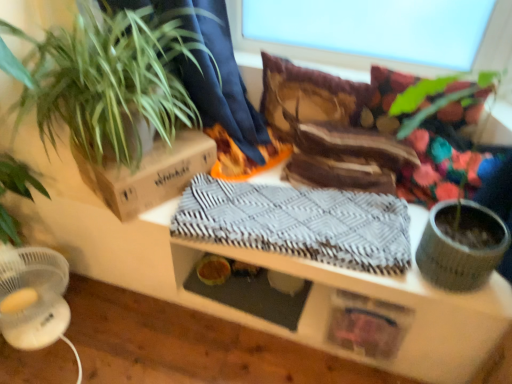
Question: From their relative heights in the image, would you say brown cardboard box at upper left is taller or shorter than gray woven blanket at center?

Choices:
 (A) short
 (B) tall

Answer: (B)

Question: From a real-world perspective, is brown cardboard box at upper left above or below gray woven blanket at center?

Choices:
 (A) above
 (B) below

Answer: (A)

Question: Estimate the real-world distances between objects in this image. Which object is closer to the brown cardboard box at upper left?

Choices:
 (A) green leafy plant at left
 (B) gray woven blanket at center
 (C) velvet brown pillow at center
 (D) transparent glass window screen at upper center
 (E) textured wood table at center

Answer: (A)

Question: Based on their relative distances, which object is nearer to the transparent glass window screen at upper center?

Choices:
 (A) gray woven blanket at center
 (B) brown cardboard box at upper left
 (C) green leafy plant at left
 (D) textured wood table at center
 (E) velvet brown pillow at center

Answer: (E)